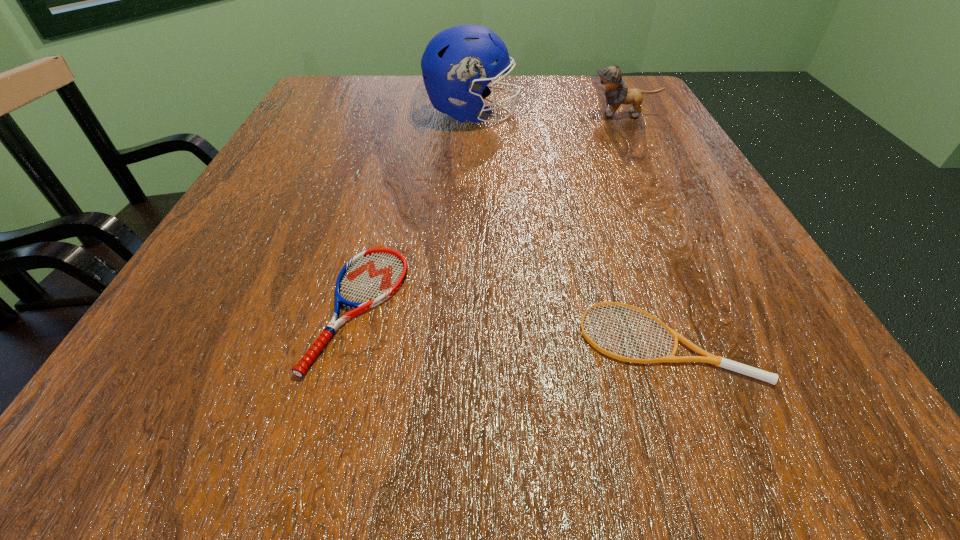
Identify the location of football helmet. (457, 63).

Identify the location of kitten. (610, 79).

At what (x,y) coordinates should I click in order to perform the action: click on the left tennis racket. Please return your answer as a coordinate pair (x, y). The width and height of the screenshot is (960, 540). Looking at the image, I should click on tap(371, 277).

Locate an element on the screen. the right tennis racket is located at coordinates (705, 357).

Where is `free space located on the front-facing side of the football helmet`? This screenshot has height=540, width=960. free space located on the front-facing side of the football helmet is located at coordinates (629, 114).

Locate an element on the screen. vacant space located 0.210m on the front-facing side of the kitten is located at coordinates (492, 114).

The height and width of the screenshot is (540, 960). I want to click on vacant region located on the front-facing side of the kitten, so click(x=446, y=114).

You are a GUI agent. You are given a task and a screenshot of the screen. Output one action in this format:
    pyautogui.click(x=<x>, y=<y>)
    Task: Click on the vacant position located on the front-facing side of the kitten
    
    Given the screenshot: What is the action you would take?
    [529, 114]

I want to click on vacant space located 0.300m on the right of the left tennis racket, so click(x=635, y=308).

Identify the location of vacant space located 0.130m on the left of the right tennis racket. This screenshot has width=960, height=540. (469, 339).